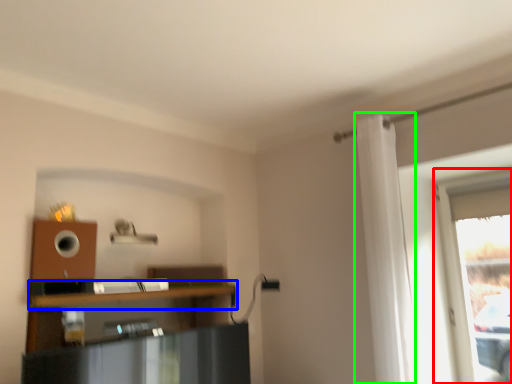
Question: Which is farther away from window (highlighted by a red box)? shelf (highlighted by a blue box) or curtain (highlighted by a green box)?

Choices:
 (A) shelf
 (B) curtain

Answer: (A)